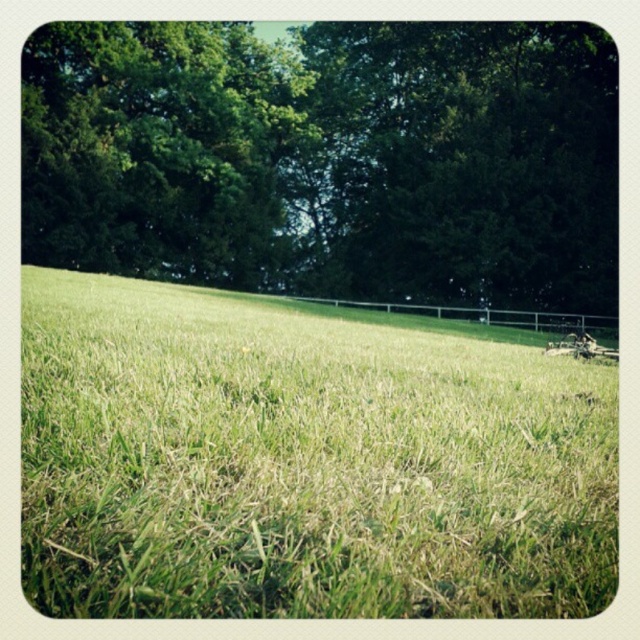
You are planning to plant a new tree in the field. You have two options based on the trees in the image. Which tree, the green leafy tree at upper center or the green leafy tree at upper left, would you choose if you want a wider tree for shade?

The green leafy tree at upper center has a greater width than the green leafy tree at upper left, so it would be the better choice for a wider tree providing more shade.

You are standing at the point marked as point (x=301, y=461) in the image. What type of terrain are you currently standing on?

The point (x=301, y=461) is on green grass at center, so you are standing on green grass.